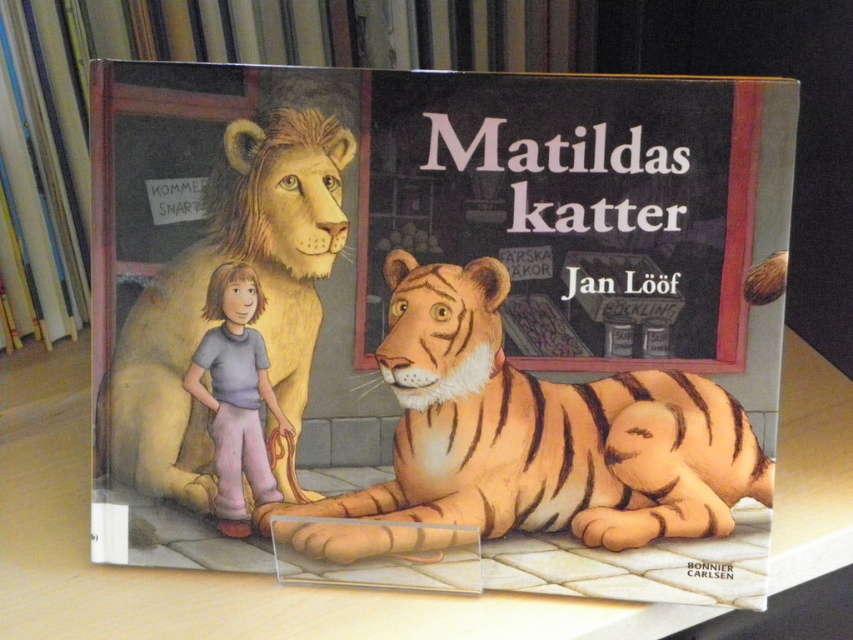
Question: Which of the following is the closest to the observer?

Choices:
 (A) beige fur lion at left
 (B) matte paper book cover at center
 (C) orange striped tiger at center

Answer: (B)

Question: Which object is the closest to the orange striped tiger at center?

Choices:
 (A) beige fur lion at left
 (B) matte paper book cover at center

Answer: (B)

Question: From the image, what is the correct spatial relationship of matte paper book cover at center in relation to orange striped tiger at center?

Choices:
 (A) left
 (B) right

Answer: (A)

Question: Is matte paper book cover at center bigger than orange striped tiger at center?

Choices:
 (A) no
 (B) yes

Answer: (B)

Question: Among these objects, which one is farthest from the camera?

Choices:
 (A) orange striped tiger at center
 (B) matte paper book cover at center
 (C) beige fur lion at left

Answer: (C)

Question: Is matte paper book cover at center in front of orange striped tiger at center?

Choices:
 (A) yes
 (B) no

Answer: (A)